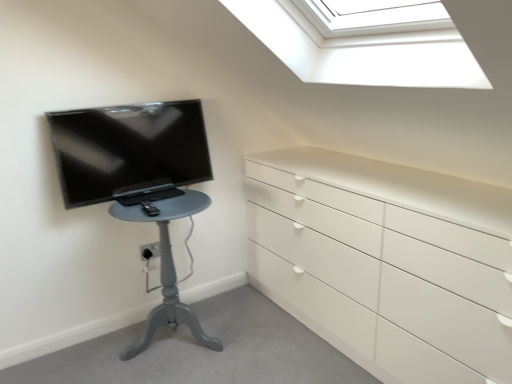
In order to click on spots to the right of matte gray table at left in this screenshot , I will do `click(249, 337)`.